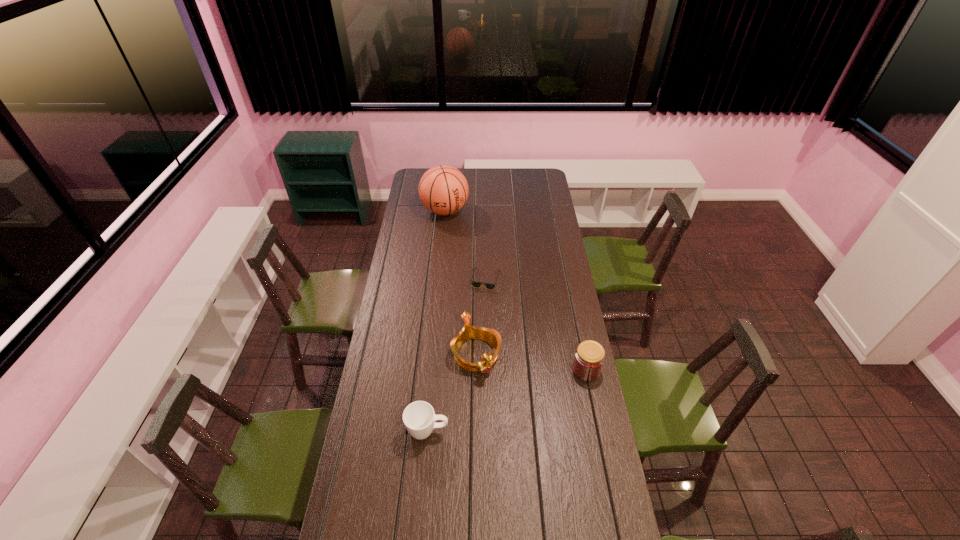
The image size is (960, 540). Identify the location of vacant space at the far edge of the desktop. (507, 176).

Image resolution: width=960 pixels, height=540 pixels. In the image, there is a desktop. Find the location of `free space at the near edge`. free space at the near edge is located at coordinates (458, 507).

In the image, there is a desktop. Where is `blank space at the left edge`? blank space at the left edge is located at coordinates (417, 241).

Identify the location of empty space between the tiara and the shortest object. Image resolution: width=960 pixels, height=540 pixels. (481, 317).

This screenshot has width=960, height=540. I want to click on vacant region between the rightmost object and the sunglasses, so click(x=536, y=325).

At what (x,y) coordinates should I click in order to perform the action: click on free space between the tiara and the tallest object. Please return your answer as a coordinate pair (x, y). Looking at the image, I should click on (461, 283).

Locate an element on the screen. This screenshot has width=960, height=540. free area in between the cup and the tiara is located at coordinates (452, 393).

You are a GUI agent. You are given a task and a screenshot of the screen. Output one action in this format:
    pyautogui.click(x=<x>, y=<y>)
    Task: Click on the empty location between the rightmost object and the basketball
    The image size is (960, 540).
    Given the screenshot: What is the action you would take?
    pyautogui.click(x=516, y=291)

Image resolution: width=960 pixels, height=540 pixels. In order to click on vacant space that is in between the jam and the sunglasses in this screenshot , I will do `click(536, 325)`.

At what (x,y) coordinates should I click in order to perform the action: click on blank region between the cup and the tiara. Please return your answer as a coordinate pair (x, y). Looking at the image, I should click on (452, 393).